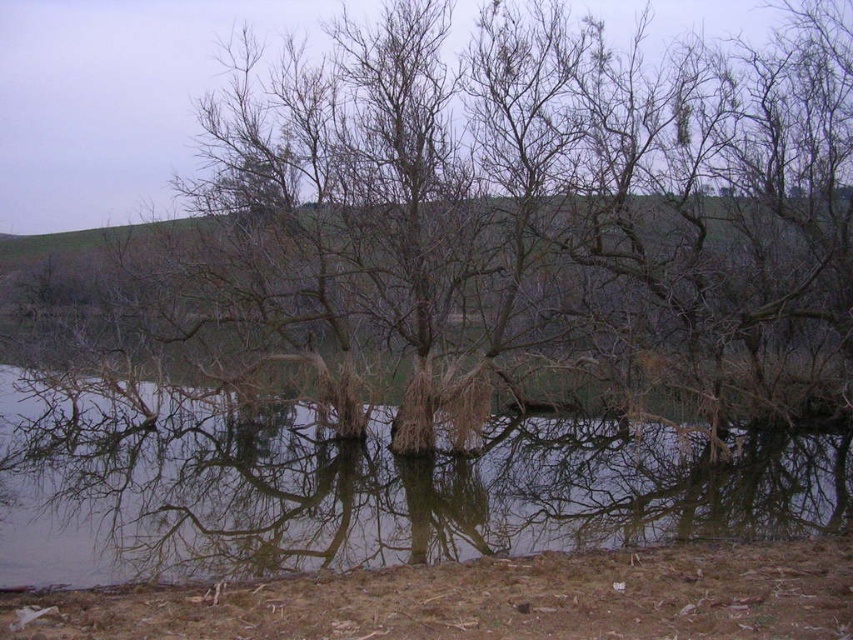
Question: Which object appears farthest from the camera in this image?

Choices:
 (A) brown/dry wood tree at center
 (B) brown matte tree at center
 (C) transparent water at center

Answer: (A)

Question: Is brown/dry wood tree at center further to the viewer compared to brown matte tree at center?

Choices:
 (A) no
 (B) yes

Answer: (B)

Question: Is transparent water at center wider than brown matte tree at center?

Choices:
 (A) no
 (B) yes

Answer: (B)

Question: Which of the following is the closest to the observer?

Choices:
 (A) (474, 525)
 (B) (775, 230)
 (C) (486, 506)

Answer: (A)

Question: Can you confirm if brown/dry wood tree at center is bigger than brown matte tree at center?

Choices:
 (A) yes
 (B) no

Answer: (A)

Question: Which object is closer to the camera taking this photo?

Choices:
 (A) transparent water at center
 (B) brown matte tree at center
 (C) brown/dry wood tree at center

Answer: (A)